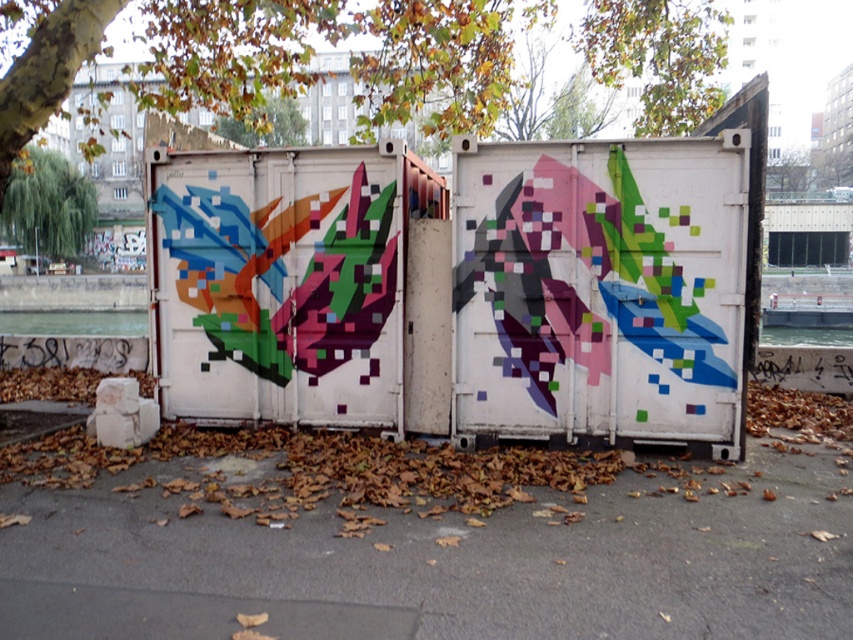
Identify the location of brown asphalt at center. click(x=439, y=560).

Find the location of `brown asphalt at center`. brown asphalt at center is located at coordinates (439, 560).

I want to click on brown asphalt at center, so click(439, 560).

Who is more distant from viewer, (x=840, y=508) or (x=12, y=240)?

Point (x=12, y=240)

This screenshot has height=640, width=853. Find the location of `brown asphalt at center`. brown asphalt at center is located at coordinates (439, 560).

Does green leafy tree at left have a larger size compared to green leafy tree at upper center?

Yes.

Based on the photo, how far apart are green leafy tree at left and green leafy tree at upper center?

21.82 meters

Does point (22, 193) come behind point (279, 122)?

Yes, it is.

At what (x,y) coordinates should I click in order to perform the action: click on green leafy tree at left. Please return your answer as a coordinate pair (x, y). The height and width of the screenshot is (640, 853). Looking at the image, I should click on (47, 204).